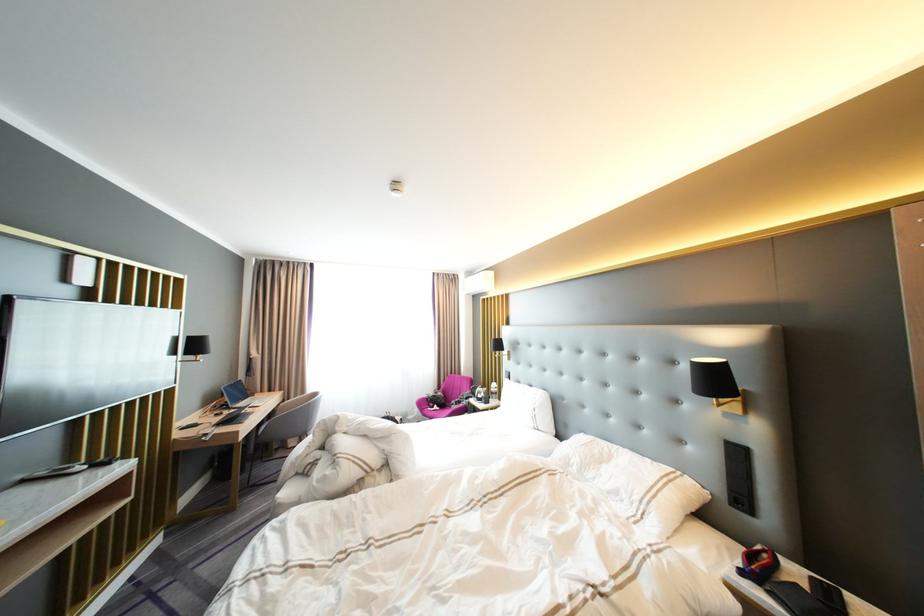
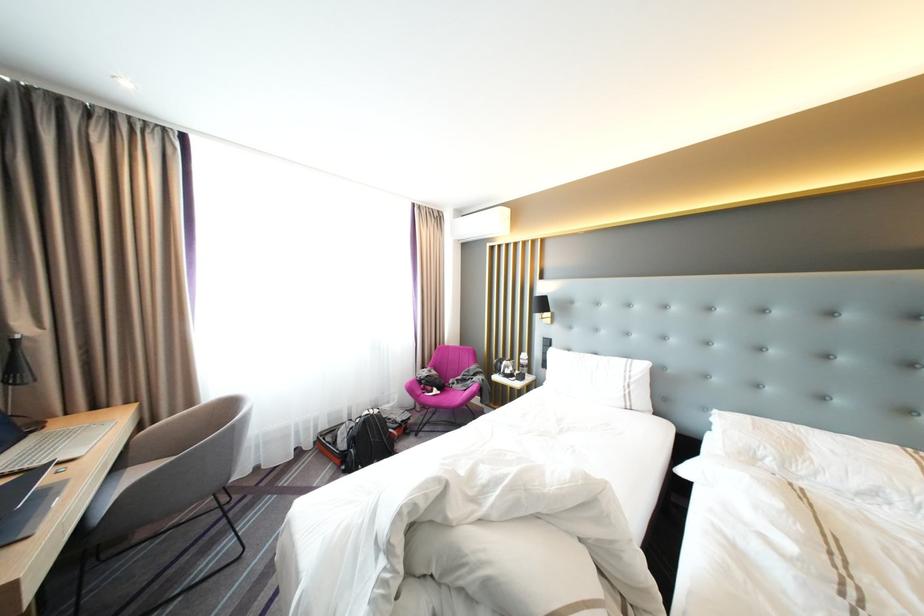
In a continuous first-person perspective shot, in which direction is the camera moving?

The movement direction of the cameraman is left, forward.